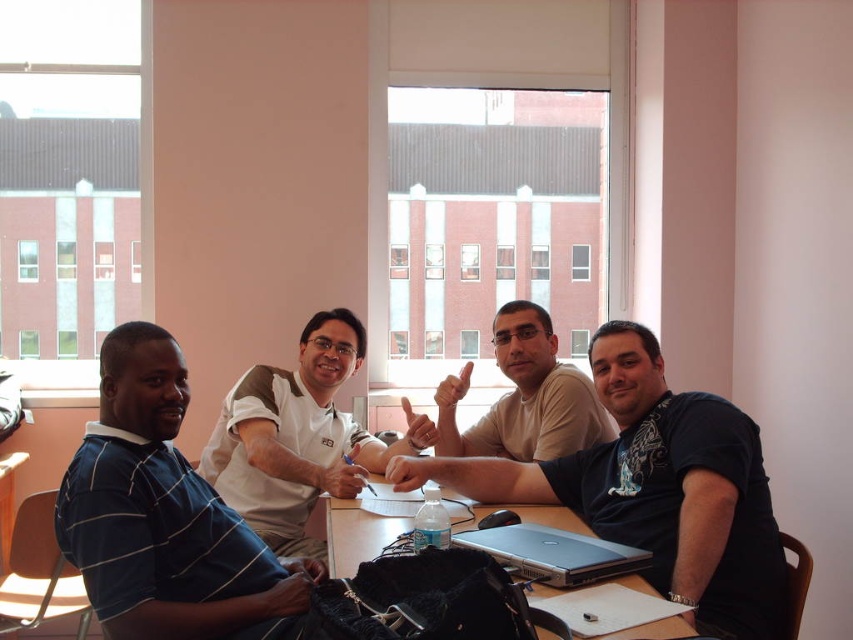
Question: Considering the real-world distances, which object is closest to the silver metallic table at center?

Choices:
 (A) dark blue t-shirt at center
 (B) light beige shirt at center
 (C) silver metallic laptop at center

Answer: (A)

Question: Is blue striped shirt at left bigger than silver metallic table at center?

Choices:
 (A) no
 (B) yes

Answer: (B)

Question: Which point is farther from the camera taking this photo?

Choices:
 (A) (250, 554)
 (B) (296, 504)
 (C) (492, 428)
 (D) (660, 632)

Answer: (C)

Question: Which is farther from the blue striped shirt at left?

Choices:
 (A) silver metallic laptop at center
 (B) light beige shirt at center
 (C) dark blue t-shirt at center
 (D) silver metallic table at center

Answer: (B)

Question: Is the position of dark blue t-shirt at center less distant than that of white matte shirt at center?

Choices:
 (A) no
 (B) yes

Answer: (B)

Question: Can you confirm if white matte shirt at center is positioned below light beige shirt at center?

Choices:
 (A) no
 (B) yes

Answer: (B)